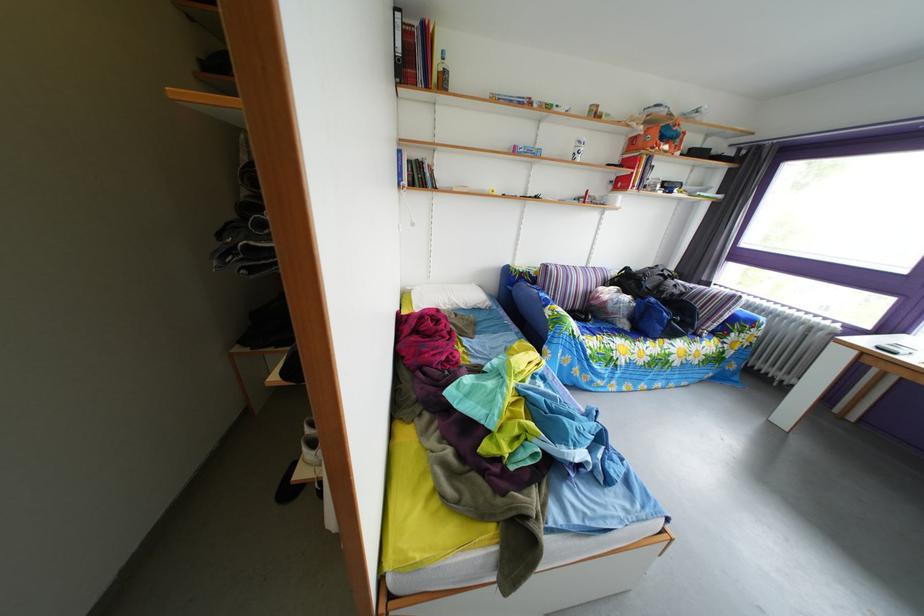
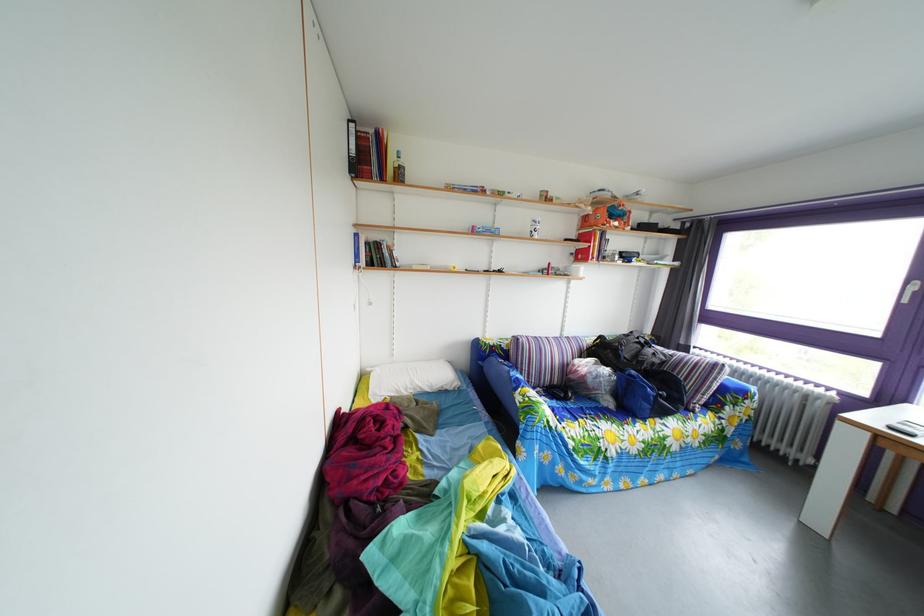
In a continuous first-person perspective shot, in which direction is the camera moving?

The cameraman moved toward right, forward.